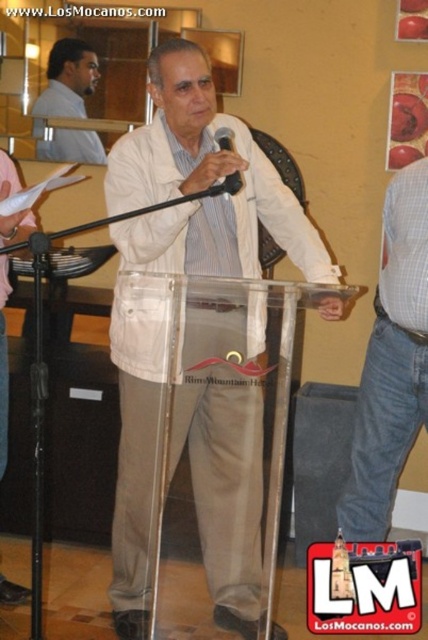
Question: Can you confirm if white matte jacket at center is smaller than matte white shirt at upper left?

Choices:
 (A) no
 (B) yes

Answer: (A)

Question: Observing the image, what is the correct spatial positioning of matte beige pants at lower right in reference to black matte microphone at center?

Choices:
 (A) left
 (B) right

Answer: (B)

Question: Considering the real-world distances, which object is farthest from the matte beige pants at lower right?

Choices:
 (A) matte white shirt at upper left
 (B) white matte jacket at center

Answer: (A)

Question: Can you confirm if white matte jacket at center is thinner than denim jeans at right?

Choices:
 (A) no
 (B) yes

Answer: (A)

Question: Among these points, which one is nearest to the camera?

Choices:
 (A) (217, 147)
 (B) (330, 516)

Answer: (A)

Question: Among these objects, which one is farthest from the camera?

Choices:
 (A) matte white shirt at upper left
 (B) denim jeans at right

Answer: (A)